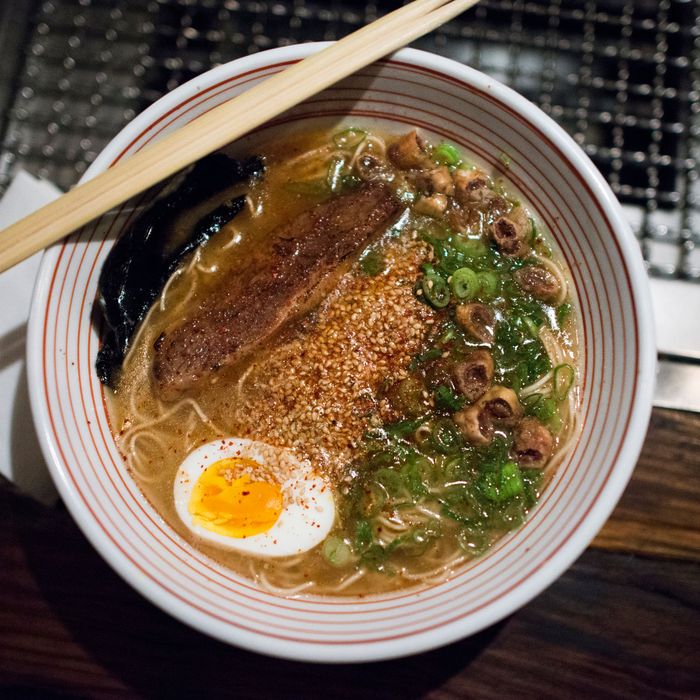
In order to click on chopstick's shadow in this screenshot , I will do `click(6, 341)`.